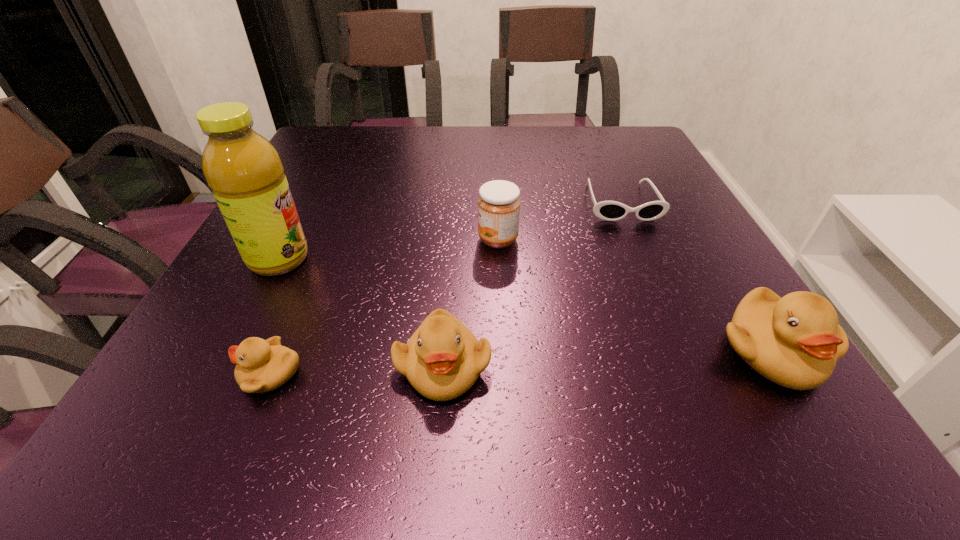
At what (x,y) coordinates should I click in order to perform the action: click on the shortest duckling. Please return your answer as a coordinate pair (x, y). The width and height of the screenshot is (960, 540). Looking at the image, I should click on (262, 365).

Identify the location of the fifth tallest object. (262, 365).

This screenshot has width=960, height=540. In order to click on the second duckling from left to right in this screenshot , I will do `click(442, 360)`.

What are the coordinates of `the rightmost duckling` in the screenshot? It's located at (795, 341).

At what (x,y) coordinates should I click in order to perform the action: click on the farthest object. Please return your answer as a coordinate pair (x, y). Image resolution: width=960 pixels, height=540 pixels. Looking at the image, I should click on (606, 210).

Where is `sunglasses`? sunglasses is located at coordinates (606, 210).

The image size is (960, 540). I want to click on jam, so click(x=499, y=203).

Image resolution: width=960 pixels, height=540 pixels. What are the coordinates of `the tallest object` in the screenshot? It's located at (246, 175).

This screenshot has height=540, width=960. I want to click on free location located 0.120m at the beak of the shortest duckling, so click(162, 374).

Where is `vacant space located at the beak of the shortest duckling`? vacant space located at the beak of the shortest duckling is located at coordinates click(181, 374).